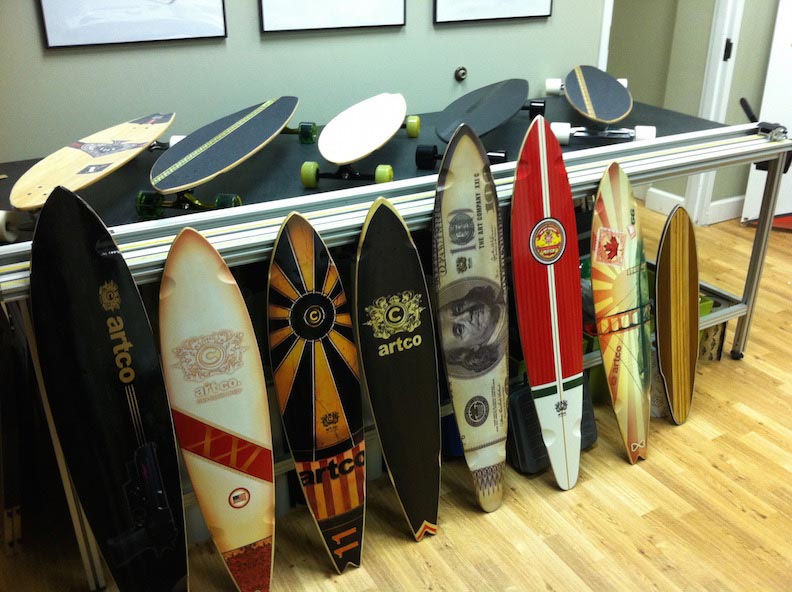
Where is `table leg`? table leg is located at coordinates (754, 272).